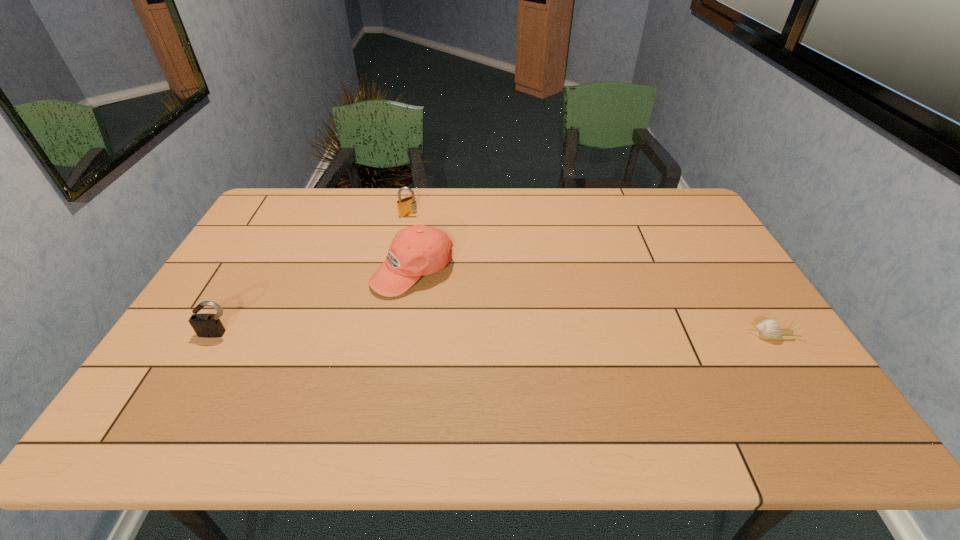
This screenshot has height=540, width=960. Find the location of `free space in the image that satisfies the following two spatial constraints: 1. on the front side of the escargot; 2. on the shell of the tallest object`. free space in the image that satisfies the following two spatial constraints: 1. on the front side of the escargot; 2. on the shell of the tallest object is located at coordinates (402, 335).

The image size is (960, 540). I want to click on vacant area in the image that satisfies the following two spatial constraints: 1. on the front side of the shortest object; 2. on the shell of the farthest object, so (382, 335).